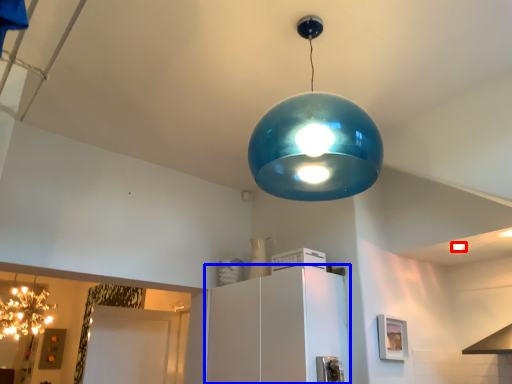
Question: Which object appears farthest to the camera in this image, light bulb (highlighted by a red box) or cabinetry (highlighted by a blue box)?

Choices:
 (A) light bulb
 (B) cabinetry

Answer: (A)